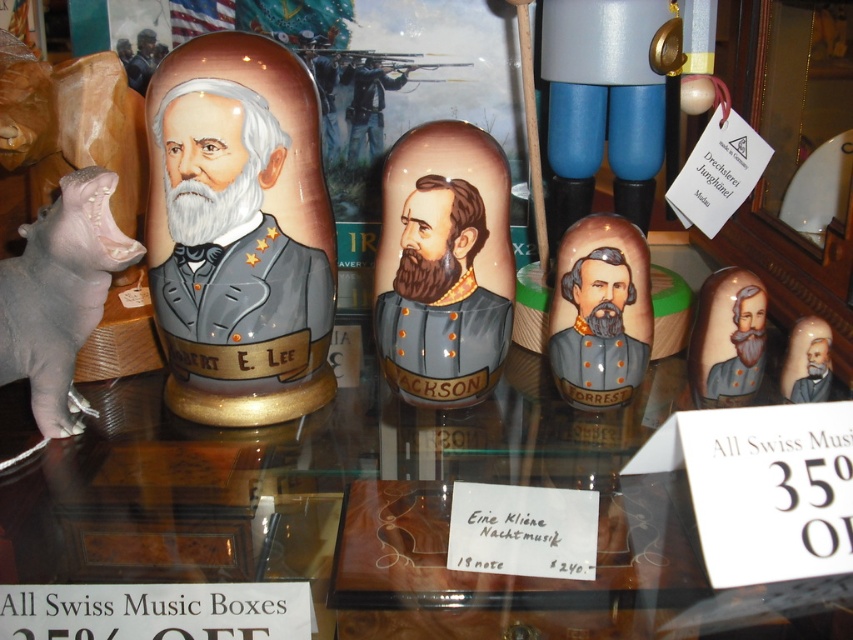
Which of these two, blue plastic nutcracker at upper center or matte gold figurine at center, stands taller?

With more height is blue plastic nutcracker at upper center.

Where is `blue plastic nutcracker at upper center`? This screenshot has height=640, width=853. blue plastic nutcracker at upper center is located at coordinates (607, 83).

Which is behind, point (703, 300) or point (787, 397)?

The point (703, 300) is more distant.

Consider the image. Is matte ceramic figurine at center smaller than matte gold figurine at center?

No.

Is point (734, 369) less distant than point (805, 356)?

No, (734, 369) is behind (805, 356).

This screenshot has width=853, height=640. Find the location of `matte ceramic figurine at center`. matte ceramic figurine at center is located at coordinates (727, 339).

Between matte gray uniform at center and matte brown uniform at center, which one has less height?

With less height is matte brown uniform at center.

Is point (320, 252) closer to camera compared to point (381, 141)?

Yes, it is in front of point (381, 141).

The image size is (853, 640). In order to click on matte gray uniform at center in this screenshot , I will do `click(234, 268)`.